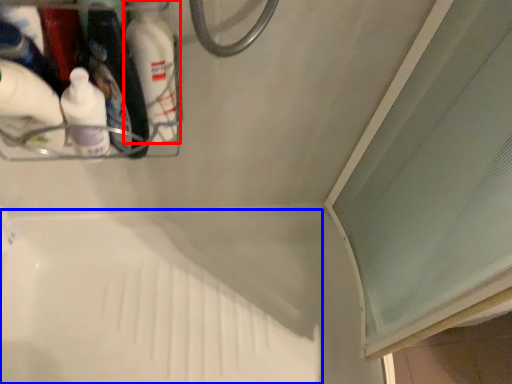
Question: Which of the following is the closest to the observer, bottle (highlighted by a red box) or bath (highlighted by a blue box)?

Choices:
 (A) bottle
 (B) bath

Answer: (A)